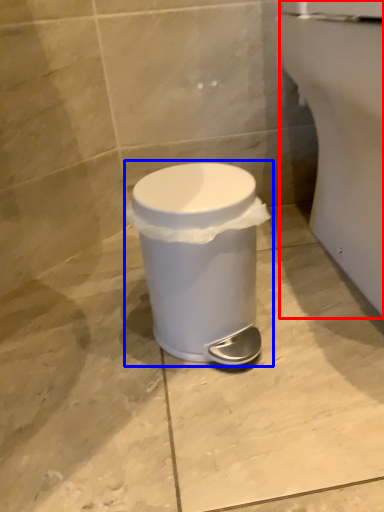
Question: Which object appears closest to the camera in this image, porcelain (highlighted by a red box) or waste container (highlighted by a blue box)?

Choices:
 (A) porcelain
 (B) waste container

Answer: (A)